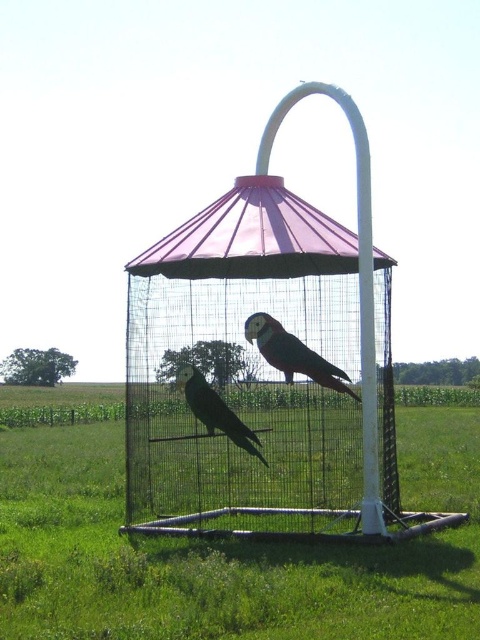
Question: Which object is farther from the camera taking this photo?

Choices:
 (A) pink mesh birdcage at center
 (B) multicolored feathered parrot at center
 (C) green grass at center

Answer: (B)

Question: Observing the image, what is the correct spatial positioning of pink mesh birdcage at center in reference to black matte parrot at center?

Choices:
 (A) left
 (B) right

Answer: (B)

Question: Which point is farther from the camera taking this photo?

Choices:
 (A) (332, 275)
 (B) (250, 440)
 (C) (288, 372)
 (D) (384, 588)

Answer: (A)

Question: Among these objects, which one is nearest to the camera?

Choices:
 (A) pink mesh birdcage at center
 (B) black matte parrot at center
 (C) multicolored feathered parrot at center
 (D) green grass at center

Answer: (D)

Question: Does multicolored feathered parrot at center come in front of black matte parrot at center?

Choices:
 (A) yes
 (B) no

Answer: (B)

Question: Is multicolored feathered parrot at center wider than black matte parrot at center?

Choices:
 (A) no
 (B) yes

Answer: (B)